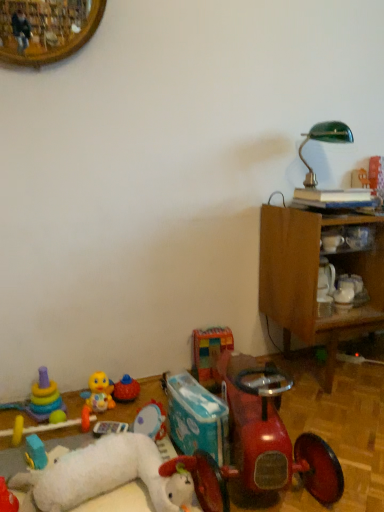
At what (x,y) coordinates should I click in order to perform the action: click on empty space that is to the right of shiny red toy car at lower right. Please return your answer as a coordinate pair (x, y). The height and width of the screenshot is (512, 384). Looking at the image, I should click on (343, 439).